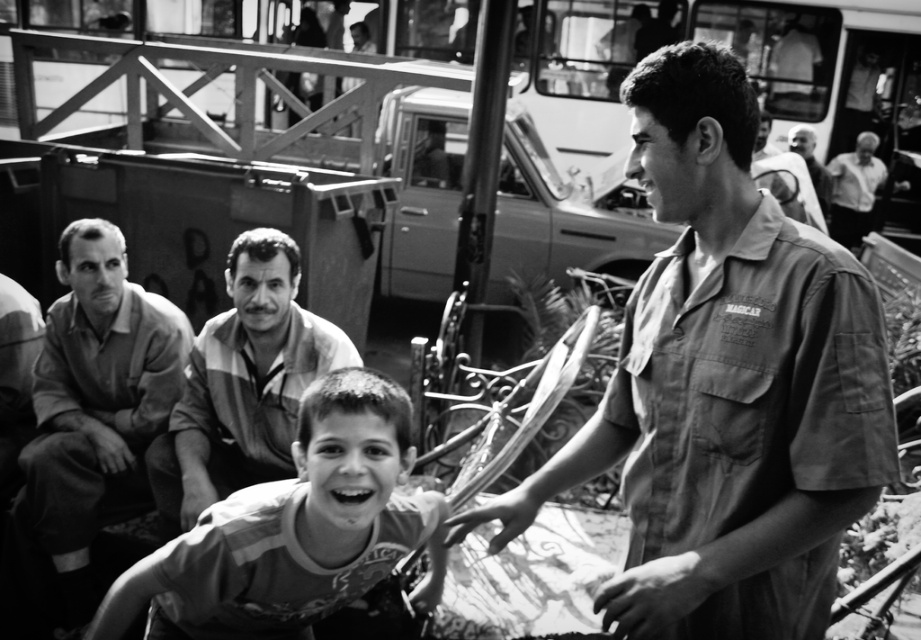
Who is more forward, (160, 380) or (225, 340)?

Point (225, 340)

Between smooth fabric shirt at left and striped fabric shirt at center, which one is positioned higher?

striped fabric shirt at center

Is point (102, 502) farther from camera compared to point (210, 396)?

Yes, it is behind point (210, 396).

You are a GUI agent. You are given a task and a screenshot of the screen. Output one action in this format:
    pyautogui.click(x=<x>, y=<y>)
    Task: Click on the smooth fabric shirt at left
    
    Given the screenshot: What is the action you would take?
    pyautogui.click(x=96, y=404)

Can you confirm if smooth fabric shirt at left is bigger than white cotton shirt at upper right?

No, smooth fabric shirt at left is not bigger than white cotton shirt at upper right.

Does smooth fabric shirt at left have a greater width compared to white cotton shirt at upper right?

In fact, smooth fabric shirt at left might be narrower than white cotton shirt at upper right.

Locate an element on the screen. This screenshot has height=640, width=921. smooth fabric shirt at left is located at coordinates click(x=96, y=404).

Where is `smooth fabric shirt at left`? This screenshot has width=921, height=640. smooth fabric shirt at left is located at coordinates (96, 404).

From the picture: Who is higher up, smooth fabric shirt at center or smooth skin face at upper right?

Positioned higher is smooth skin face at upper right.

Who is shorter, smooth fabric shirt at center or smooth skin face at upper right?

With less height is smooth skin face at upper right.

Between point (772, 355) and point (796, 138), which one is positioned in front?

Point (772, 355)

The height and width of the screenshot is (640, 921). What are the coordinates of `smooth fabric shirt at center` in the screenshot? It's located at (726, 387).